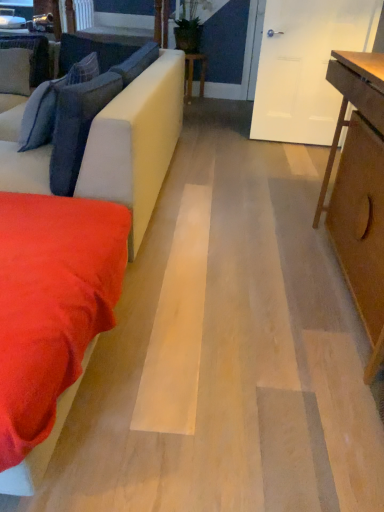
Question: Can you confirm if suede-like beige couch at left is positioned to the left of suede-like gray pillow at upper left, which is the first pillow in back-to-front order?

Choices:
 (A) yes
 (B) no

Answer: (B)

Question: Does suede-like beige couch at left have a larger size compared to suede-like gray pillow at upper left, which is the fourth pillow in front-to-back order?

Choices:
 (A) no
 (B) yes

Answer: (B)

Question: From the image's perspective, is suede-like beige couch at left located above suede-like gray pillow at upper left, which is the fourth pillow in front-to-back order?

Choices:
 (A) yes
 (B) no

Answer: (B)

Question: Can you confirm if suede-like beige couch at left is wider than suede-like gray pillow at upper left, which is the fourth pillow in front-to-back order?

Choices:
 (A) yes
 (B) no

Answer: (A)

Question: Is suede-like beige couch at left far from suede-like gray pillow at upper left, which is the first pillow in back-to-front order?

Choices:
 (A) no
 (B) yes

Answer: (B)

Question: Is point (137, 220) positioned closer to the camera than point (86, 306)?

Choices:
 (A) closer
 (B) farther

Answer: (B)

Question: In terms of width, does suede-like beige couch at left look wider or thinner when compared to suede-like red blanket at lower left?

Choices:
 (A) thin
 (B) wide

Answer: (B)

Question: In terms of height, does suede-like beige couch at left look taller or shorter compared to suede-like red blanket at lower left?

Choices:
 (A) tall
 (B) short

Answer: (A)

Question: Is suede-like beige couch at left in front of or behind suede-like red blanket at lower left in the image?

Choices:
 (A) front
 (B) behind

Answer: (B)

Question: In the image, is suede-like red blanket at lower left positioned in front of or behind light brown wooden table at right, the second table positioned from the top?

Choices:
 (A) behind
 (B) front

Answer: (B)

Question: Looking at the image, does suede-like red blanket at lower left seem bigger or smaller compared to light brown wooden table at right, which is the 1th table from right to left?

Choices:
 (A) small
 (B) big

Answer: (A)

Question: Is suede-like red blanket at lower left situated inside light brown wooden table at right, placed as the 1th table when sorted from front to back, or outside?

Choices:
 (A) inside
 (B) outside

Answer: (B)

Question: Looking at their shapes, would you say suede-like red blanket at lower left is wider or thinner than light brown wooden table at right, marked as the second table in a back-to-front arrangement?

Choices:
 (A) wide
 (B) thin

Answer: (A)

Question: From their relative heights in the image, would you say suede-like beige couch at left is taller or shorter than velvet blue pillow at upper left, the second pillow positioned from the back?

Choices:
 (A) short
 (B) tall

Answer: (B)

Question: Relative to velvet blue pillow at upper left, the second pillow positioned from the back, is suede-like beige couch at left in front or behind?

Choices:
 (A) behind
 (B) front

Answer: (B)